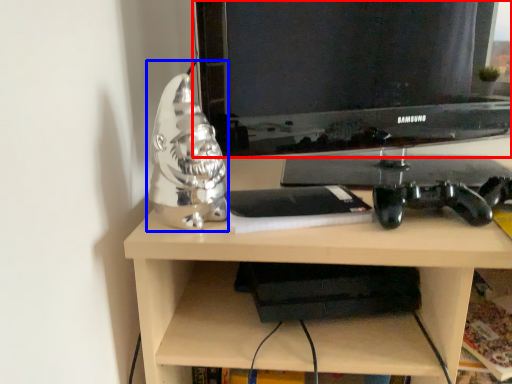
Question: Which object appears closest to the camera in this image, television (highlighted by a red box) or figurine (highlighted by a blue box)?

Choices:
 (A) television
 (B) figurine

Answer: (B)